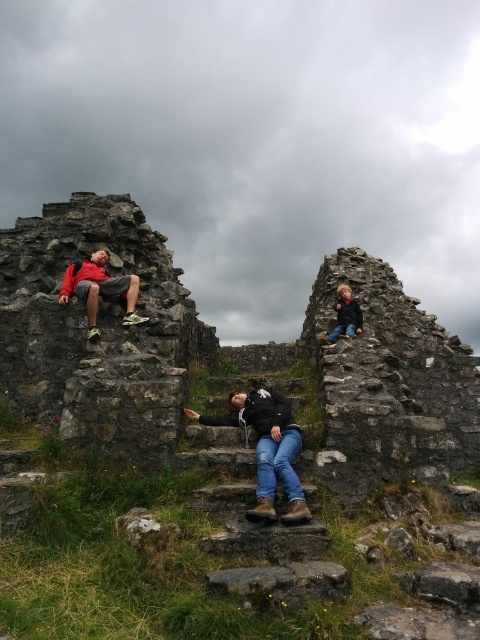
Question: Observing the image, what is the correct spatial positioning of matte black shorts at left in reference to dark blue jacket at upper right?

Choices:
 (A) below
 (B) above

Answer: (B)

Question: Which object is the closest to the rusty stone wall at upper left?

Choices:
 (A) matte black shorts at left
 (B) dark blue jacket at upper right

Answer: (B)

Question: In this image, where is rusty stone wall at upper left located relative to matte black shorts at left?

Choices:
 (A) above
 (B) below

Answer: (B)

Question: Is matte black shorts at left thinner than dark blue jacket at upper right?

Choices:
 (A) yes
 (B) no

Answer: (B)

Question: Which object appears farthest from the camera in this image?

Choices:
 (A) dark blue jacket at upper right
 (B) matte black shorts at left

Answer: (A)

Question: Which of the following is the closest to the observer?

Choices:
 (A) (110, 211)
 (B) (108, 296)

Answer: (B)